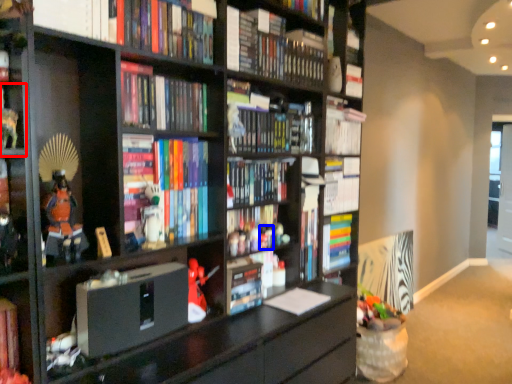
Question: Which object appears farthest to the camera in this image, shelf (highlighted by a red box) or toy (highlighted by a blue box)?

Choices:
 (A) shelf
 (B) toy

Answer: (B)